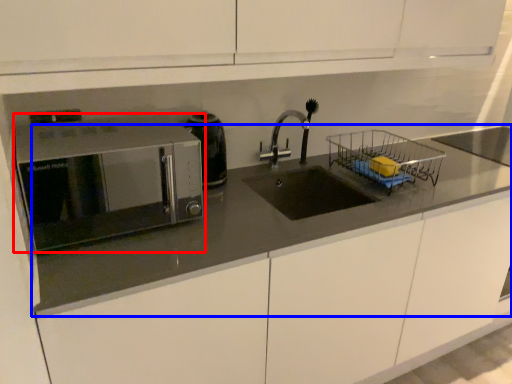
Question: Which of the following is the farthest to the observer, microwave oven (highlighted by a red box) or countertop (highlighted by a blue box)?

Choices:
 (A) microwave oven
 (B) countertop

Answer: (A)